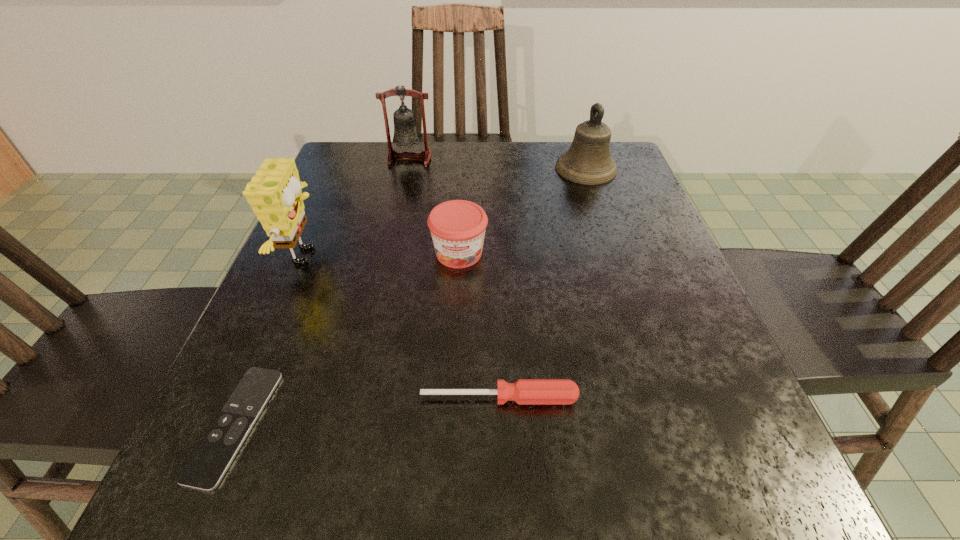
Locate an element on the screen. vacant space at the far edge of the desktop is located at coordinates pos(490,156).

I want to click on vacant space at the near edge of the desktop, so click(x=475, y=513).

The height and width of the screenshot is (540, 960). Find the location of `vacant region at the left edge of the desktop`. vacant region at the left edge of the desktop is located at coordinates (336, 199).

In the image, there is a desktop. Identify the location of vacant region at the right edge. click(x=659, y=418).

This screenshot has width=960, height=540. I want to click on vacant region at the far left corner, so click(x=393, y=144).

You are a GUI agent. You are given a task and a screenshot of the screen. Output one action in this format:
    pyautogui.click(x=<x>, y=<y>)
    Task: Click on the empty space that is in between the remote control and the fourth object from right to left
    This screenshot has width=960, height=540.
    Given the screenshot: What is the action you would take?
    pyautogui.click(x=323, y=292)

This screenshot has height=540, width=960. Identify the location of vacant region between the right bell and the shortest object. (411, 296).

Where is `free space between the fourth object from right to left and the fourth tallest object`? This screenshot has width=960, height=540. free space between the fourth object from right to left and the fourth tallest object is located at coordinates (434, 206).

The image size is (960, 540). Identify the location of vacant space that's between the left bell and the sponge. (358, 207).

Locate an element on the screen. The image size is (960, 540). vacant space that is in between the rightmost object and the second shortest object is located at coordinates (542, 283).